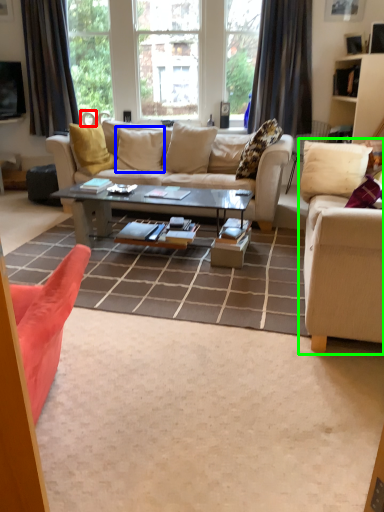
Question: Which object is positioned closest to armchair (highlighted by a red box)? Select from pillow (highlighted by a blue box) and studio couch (highlighted by a green box).

Choices:
 (A) pillow
 (B) studio couch

Answer: (A)